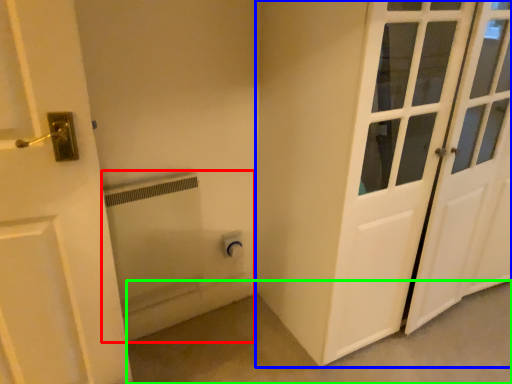
Question: Which object is the farthest from bath (highlighted by a red box)? Choose among these: door (highlighted by a blue box) or concrete (highlighted by a green box).

Choices:
 (A) door
 (B) concrete

Answer: (A)